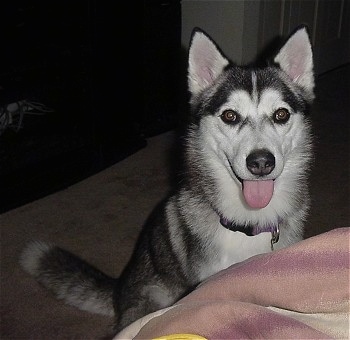
Where is `carpet`? Image resolution: width=350 pixels, height=340 pixels. carpet is located at coordinates (126, 187).